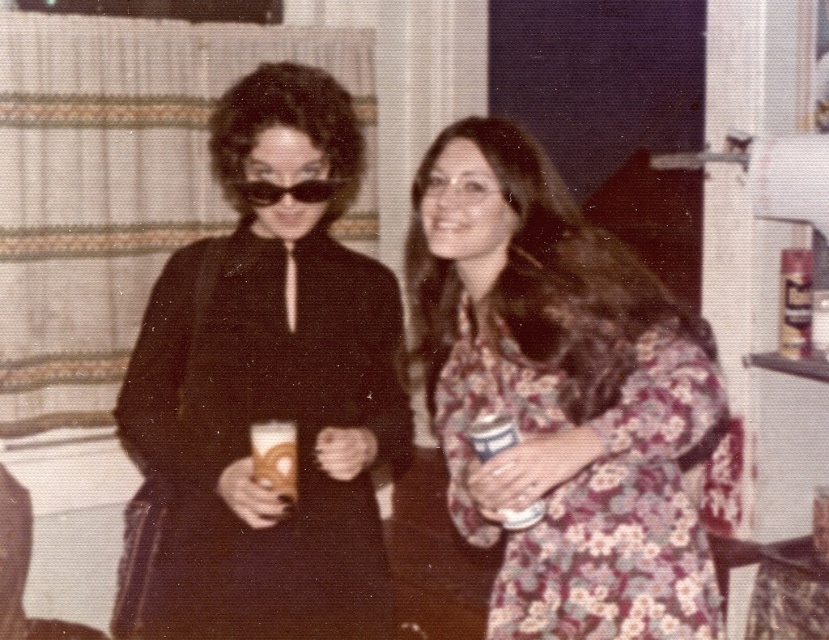
Question: Which of the following is the farthest from the observer?

Choices:
 (A) black matte dress at center
 (B) floral-patterned dress at center
 (C) matte black sunglasses at center

Answer: (C)

Question: Does floral-patterned dress at center appear on the left side of matte plastic cup at center?

Choices:
 (A) yes
 (B) no

Answer: (B)

Question: Which point is closer to the camera taking this photo?

Choices:
 (A) (293, 422)
 (B) (485, 420)
 (C) (328, 186)

Answer: (B)

Question: Is white paper cup at center to the left of matte black sunglasses at center from the viewer's perspective?

Choices:
 (A) yes
 (B) no

Answer: (B)

Question: Does black matte dress at center have a lesser width compared to floral-patterned dress at center?

Choices:
 (A) no
 (B) yes

Answer: (A)

Question: Which of the following is the closest to the observer?

Choices:
 (A) matte plastic cup at center
 (B) floral-patterned dress at center
 (C) white paper cup at center
 (D) black matte dress at center

Answer: (B)